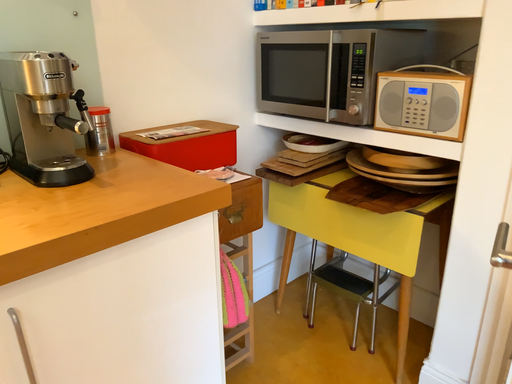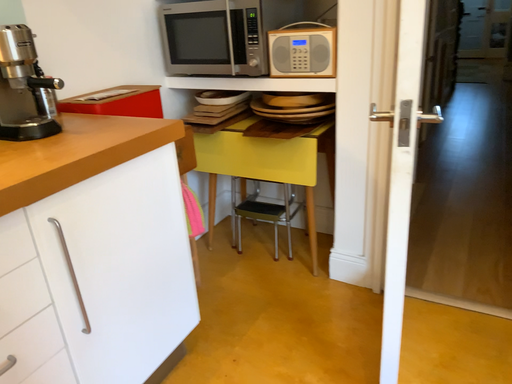
Question: Which way did the camera rotate in the video?

Choices:
 (A) rotated left
 (B) rotated right

Answer: (B)